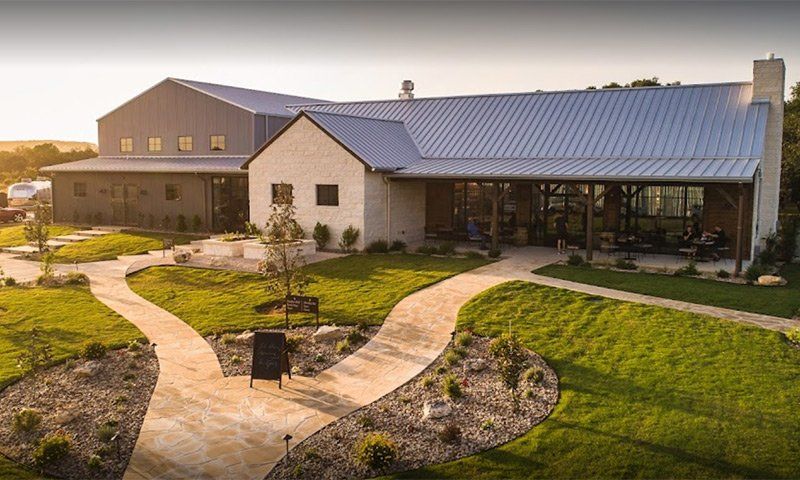
Locate an element on the screen. Image resolution: width=800 pixels, height=480 pixels. chalkboard sign is located at coordinates (274, 362).